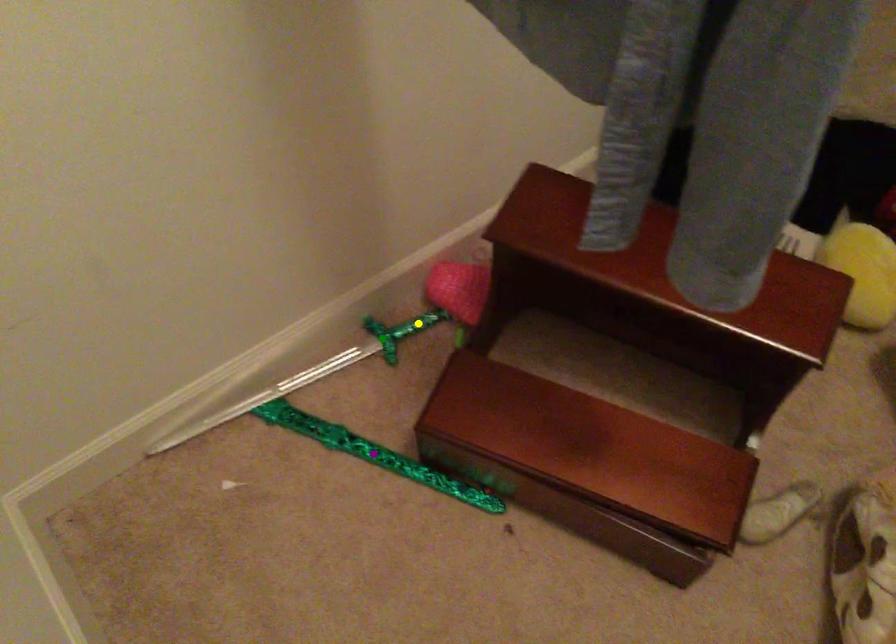
Order these from nearest to farthest:
A) yellow point
B) green point
C) purple point

purple point
green point
yellow point